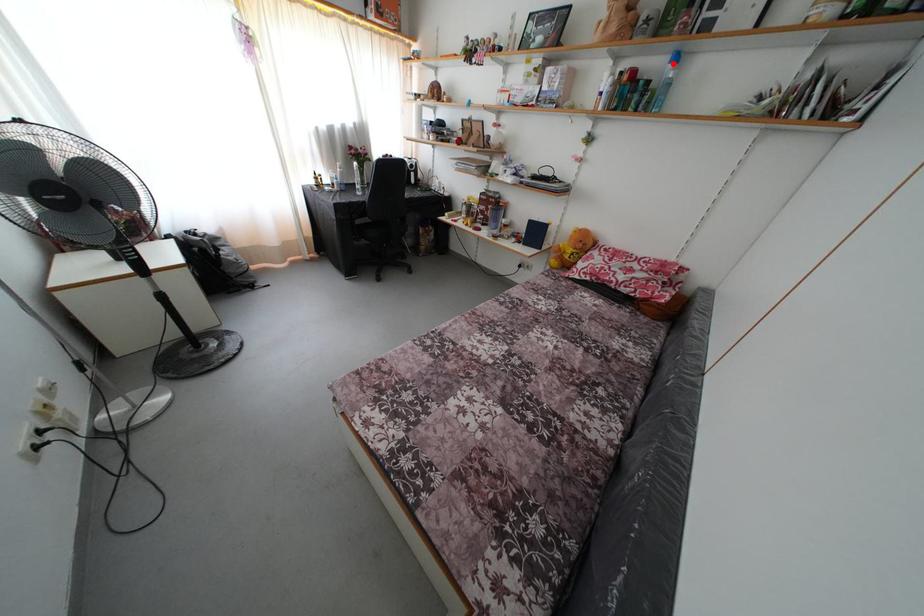
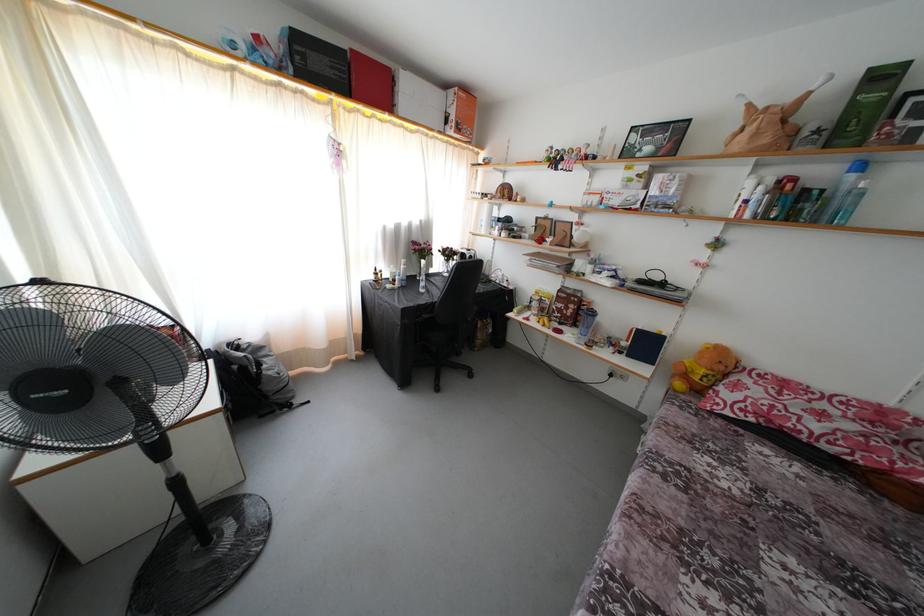
Find the pixel in the second image that matches the highlighted location in the first image.

(849, 172)